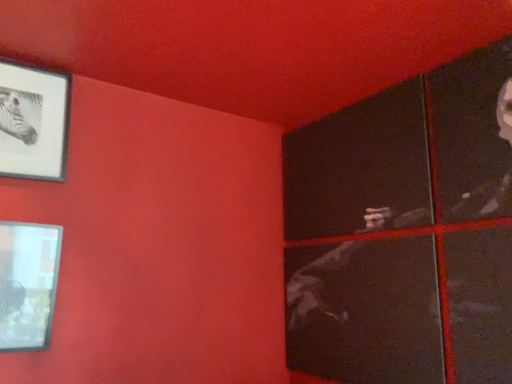
I want to click on matte glass picture frame at lower left, positioned as the first picture frame in bottom-to-top order, so click(28, 284).

Describe the element at coordinates (28, 284) in the screenshot. I see `matte glass picture frame at lower left, which is the second picture frame from top to bottom` at that location.

What is the approximate height of matte black frame at upper left, the second picture frame ordered from the bottom?

The height of matte black frame at upper left, the second picture frame ordered from the bottom, is 21.55 inches.

The height and width of the screenshot is (384, 512). What are the coordinates of `matte black frame at upper left, the first picture frame positioned from the top` in the screenshot? It's located at (33, 122).

Image resolution: width=512 pixels, height=384 pixels. What do you see at coordinates (33, 122) in the screenshot?
I see `matte black frame at upper left, the first picture frame positioned from the top` at bounding box center [33, 122].

Where is `matte glass picture frame at lower left, which is the second picture frame from top to bottom`? This screenshot has height=384, width=512. matte glass picture frame at lower left, which is the second picture frame from top to bottom is located at coordinates (28, 284).

From the picture: Between matte glass picture frame at lower left, positioned as the first picture frame in bottom-to-top order, and matte black frame at upper left, the first picture frame positioned from the top, which one appears on the left side from the viewer's perspective?

matte black frame at upper left, the first picture frame positioned from the top.

Who is more distant, matte glass picture frame at lower left, which is the second picture frame from top to bottom, or matte black frame at upper left, the first picture frame positioned from the top?

matte black frame at upper left, the first picture frame positioned from the top, is further from the camera.

Is point (47, 241) farther from viewer compared to point (10, 107)?

No, (47, 241) is closer to viewer.

From the image's perspective, is matte glass picture frame at lower left, which is the second picture frame from top to bottom, located beneath matte black frame at upper left, the second picture frame ordered from the bottom?

Indeed, from the image's perspective, matte glass picture frame at lower left, which is the second picture frame from top to bottom, is shown beneath matte black frame at upper left, the second picture frame ordered from the bottom.

From a real-world perspective, relative to matte black frame at upper left, the first picture frame positioned from the top, is matte glass picture frame at lower left, which is the second picture frame from top to bottom, vertically above or below?

matte glass picture frame at lower left, which is the second picture frame from top to bottom, is situated lower than matte black frame at upper left, the first picture frame positioned from the top, in the real world.

Between matte glass picture frame at lower left, positioned as the first picture frame in bottom-to-top order, and matte black frame at upper left, the first picture frame positioned from the top, which one has larger width?

matte glass picture frame at lower left, positioned as the first picture frame in bottom-to-top order.

Is matte glass picture frame at lower left, which is the second picture frame from top to bottom, taller than matte black frame at upper left, the second picture frame ordered from the bottom?

No, matte glass picture frame at lower left, which is the second picture frame from top to bottom, is not taller than matte black frame at upper left, the second picture frame ordered from the bottom.

Based on the photo, is matte glass picture frame at lower left, positioned as the first picture frame in bottom-to-top order, smaller than matte black frame at upper left, the second picture frame ordered from the bottom?

Actually, matte glass picture frame at lower left, positioned as the first picture frame in bottom-to-top order, might be larger than matte black frame at upper left, the second picture frame ordered from the bottom.

Is matte black frame at upper left, the first picture frame positioned from the top, completely or partially inside matte glass picture frame at lower left, positioned as the first picture frame in bottom-to-top order?

No, matte black frame at upper left, the first picture frame positioned from the top, is located outside of matte glass picture frame at lower left, positioned as the first picture frame in bottom-to-top order.

Is matte glass picture frame at lower left, which is the second picture frame from top to bottom, far from matte black frame at upper left, the second picture frame ordered from the bottom?

Actually, matte glass picture frame at lower left, which is the second picture frame from top to bottom, and matte black frame at upper left, the second picture frame ordered from the bottom, are a little close together.

Is matte glass picture frame at lower left, positioned as the first picture frame in bottom-to-top order, positioned with its back to matte black frame at upper left, the first picture frame positioned from the top?

No, matte glass picture frame at lower left, positioned as the first picture frame in bottom-to-top order, is not facing the opposite direction of matte black frame at upper left, the first picture frame positioned from the top.

How different are the orientations of matte glass picture frame at lower left, positioned as the first picture frame in bottom-to-top order, and matte black frame at upper left, the second picture frame ordered from the bottom, in degrees?

The angular difference between matte glass picture frame at lower left, positioned as the first picture frame in bottom-to-top order, and matte black frame at upper left, the second picture frame ordered from the bottom, is 0.0503 degrees.

The width and height of the screenshot is (512, 384). There is a matte glass picture frame at lower left, positioned as the first picture frame in bottom-to-top order. Find the location of `picture frame above it (from a real-world perspective)`. picture frame above it (from a real-world perspective) is located at coordinates (33, 122).

Can you confirm if matte black frame at upper left, the first picture frame positioned from the top, is positioned to the left of matte glass picture frame at lower left, positioned as the first picture frame in bottom-to-top order?

Yes.

Consider the image. Is the depth of matte black frame at upper left, the second picture frame ordered from the bottom, greater than that of matte glass picture frame at lower left, positioned as the first picture frame in bottom-to-top order?

That is True.

Between point (23, 124) and point (12, 228), which one is positioned in front?

The point (12, 228) is more forward.

From the image's perspective, is matte black frame at upper left, the first picture frame positioned from the top, above matte glass picture frame at lower left, which is the second picture frame from top to bottom?

Yes, from the image's perspective, matte black frame at upper left, the first picture frame positioned from the top, is over matte glass picture frame at lower left, which is the second picture frame from top to bottom.

From a real-world perspective, who is located higher, matte black frame at upper left, the second picture frame ordered from the bottom, or matte glass picture frame at lower left, which is the second picture frame from top to bottom?

In real-world perspective, matte black frame at upper left, the second picture frame ordered from the bottom, is above.

Looking at their sizes, would you say matte black frame at upper left, the second picture frame ordered from the bottom, is wider or thinner than matte glass picture frame at lower left, which is the second picture frame from top to bottom?

Clearly, matte black frame at upper left, the second picture frame ordered from the bottom, has less width compared to matte glass picture frame at lower left, which is the second picture frame from top to bottom.

Considering the relative sizes of matte black frame at upper left, the first picture frame positioned from the top, and matte glass picture frame at lower left, which is the second picture frame from top to bottom, in the image provided, is matte black frame at upper left, the first picture frame positioned from the top, shorter than matte glass picture frame at lower left, which is the second picture frame from top to bottom,?

In fact, matte black frame at upper left, the first picture frame positioned from the top, may be taller than matte glass picture frame at lower left, which is the second picture frame from top to bottom.

Considering the sizes of matte black frame at upper left, the second picture frame ordered from the bottom, and matte glass picture frame at lower left, which is the second picture frame from top to bottom, in the image, is matte black frame at upper left, the second picture frame ordered from the bottom, bigger or smaller than matte glass picture frame at lower left, which is the second picture frame from top to bottom,?

Clearly, matte black frame at upper left, the second picture frame ordered from the bottom, is smaller in size than matte glass picture frame at lower left, which is the second picture frame from top to bottom.

Would you say matte black frame at upper left, the second picture frame ordered from the bottom, is inside or outside matte glass picture frame at lower left, which is the second picture frame from top to bottom?

matte black frame at upper left, the second picture frame ordered from the bottom, is not enclosed by matte glass picture frame at lower left, which is the second picture frame from top to bottom.

Are matte black frame at upper left, the first picture frame positioned from the top, and matte glass picture frame at lower left, which is the second picture frame from top to bottom, far apart?

matte black frame at upper left, the first picture frame positioned from the top, is near matte glass picture frame at lower left, which is the second picture frame from top to bottom, not far away.

Looking at this image, is matte black frame at upper left, the first picture frame positioned from the top, oriented towards matte glass picture frame at lower left, positioned as the first picture frame in bottom-to-top order?

No, matte black frame at upper left, the first picture frame positioned from the top, is not turned towards matte glass picture frame at lower left, positioned as the first picture frame in bottom-to-top order.

Can you tell me how much matte black frame at upper left, the second picture frame ordered from the bottom, and matte glass picture frame at lower left, which is the second picture frame from top to bottom, differ in facing direction?

The angular difference between matte black frame at upper left, the second picture frame ordered from the bottom, and matte glass picture frame at lower left, which is the second picture frame from top to bottom, is 0.0503 degrees.

Find the location of a particular element. The height and width of the screenshot is (384, 512). picture frame that is under the matte black frame at upper left, the second picture frame ordered from the bottom (from a real-world perspective) is located at coordinates (28, 284).

Find the location of `picture frame above the matte glass picture frame at lower left, which is the second picture frame from top to bottom (from the image's perspective)`. picture frame above the matte glass picture frame at lower left, which is the second picture frame from top to bottom (from the image's perspective) is located at coordinates (33, 122).

Where is `picture frame below the matte black frame at upper left, the first picture frame positioned from the top (from the image's perspective)`? picture frame below the matte black frame at upper left, the first picture frame positioned from the top (from the image's perspective) is located at coordinates (28, 284).